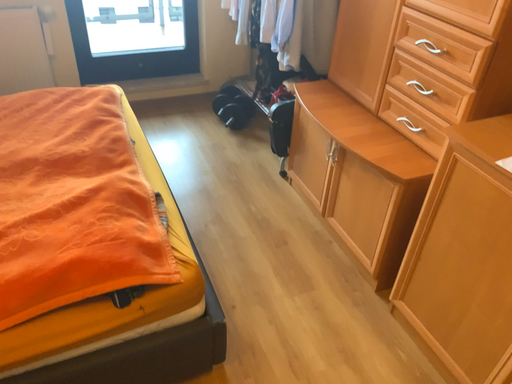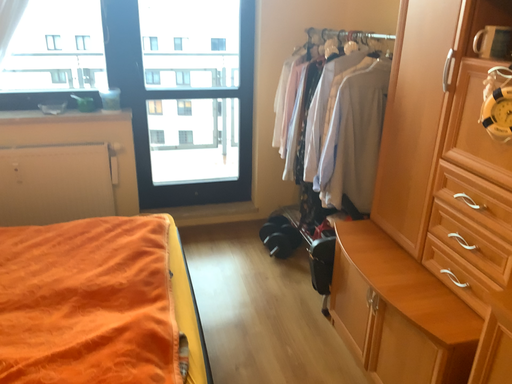
Question: Which way did the camera rotate in the video?

Choices:
 (A) rotated right
 (B) rotated left

Answer: (B)